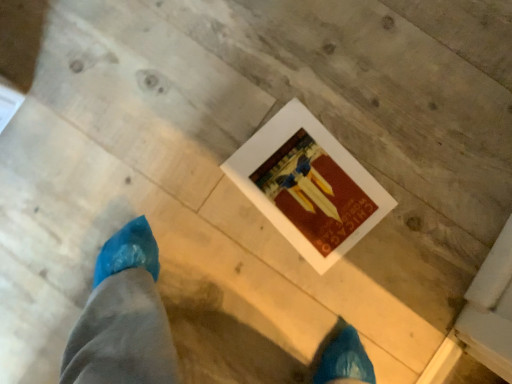
Where is `free space to the left of matte paper postcard at center`? free space to the left of matte paper postcard at center is located at coordinates (206, 236).